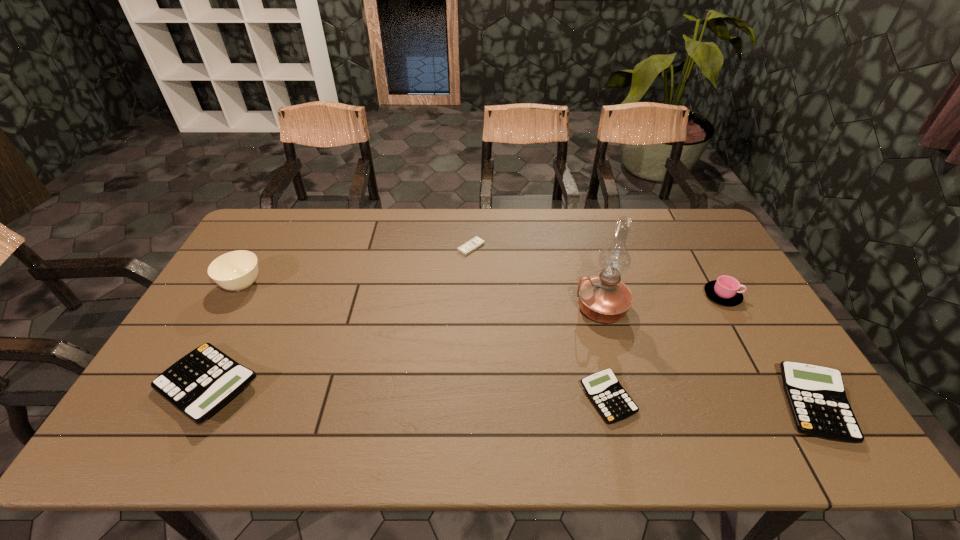
The width and height of the screenshot is (960, 540). I want to click on vacant space located on the back of the leftmost calculator, so click(x=271, y=267).

Locate an element on the screen. This screenshot has height=540, width=960. free space located 0.370m on the left of the second shortest object is located at coordinates (431, 399).

You are a GUI agent. You are given a task and a screenshot of the screen. Output one action in this format:
    pyautogui.click(x=<x>, y=<y>)
    Task: Click on the vacant space located 0.300m on the back of the fifth tallest object
    
    Given the screenshot: What is the action you would take?
    pyautogui.click(x=743, y=288)

The width and height of the screenshot is (960, 540). What are the coordinates of `free spot located on the back of the tallest object` in the screenshot? It's located at (584, 245).

Identify the location of vacant space situated on the front of the shortest object. (469, 311).

This screenshot has width=960, height=540. Find the location of `free space located on the front of the sugar bowl`. free space located on the front of the sugar bowl is located at coordinates (195, 371).

Identify the location of object that is at the far edge. (465, 249).

This screenshot has height=540, width=960. In order to click on calculator that is at the left edge in this screenshot , I will do `click(200, 383)`.

Locate an element on the screen. The image size is (960, 540). sugar bowl located at the left edge is located at coordinates (236, 271).

Find the location of a particular element. calculator that is at the right edge is located at coordinates (816, 395).